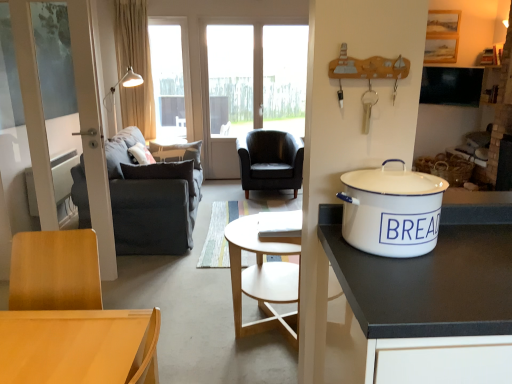
Question: From a real-world perspective, is dark gray fabric couch at left positioned above or below white enamel bread bin at right?

Choices:
 (A) below
 (B) above

Answer: (A)

Question: Is dark gray fabric couch at left in front of or behind white enamel bread bin at right in the image?

Choices:
 (A) behind
 (B) front

Answer: (A)

Question: Which object is positioned closest to the dark gray fabric couch at left?

Choices:
 (A) white enamel bread bin at right
 (B) light brown wood desk at lower left
 (C) transparent glass window at upper center
 (D) black leather chair at center
 (E) beige fabric curtain at upper left

Answer: (D)

Question: Estimate the real-world distances between objects in this image. Which object is farther from the black leather chair at center?

Choices:
 (A) beige fabric curtain at upper left
 (B) transparent glass window at upper center
 (C) dark gray fabric couch at left
 (D) white enamel bread bin at right
 (E) light brown wood desk at lower left

Answer: (E)